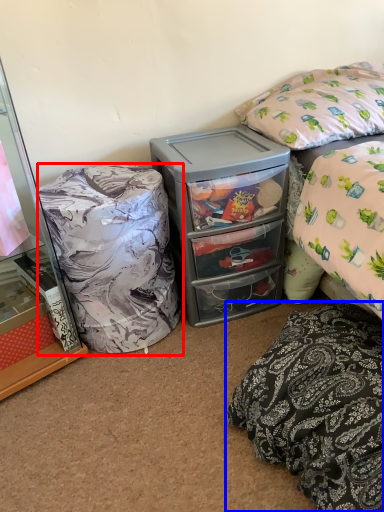
Question: Which of the following is the farthest to the observer, bean bag chair (highlighted by a red box) or pillow (highlighted by a blue box)?

Choices:
 (A) bean bag chair
 (B) pillow

Answer: (A)